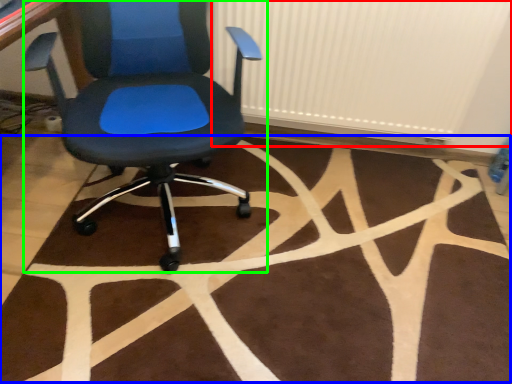
Question: Considering the real-world distances, which object is closest to radiator (highlighted by a red box)? mat (highlighted by a blue box) or chair (highlighted by a green box).

Choices:
 (A) mat
 (B) chair

Answer: (B)